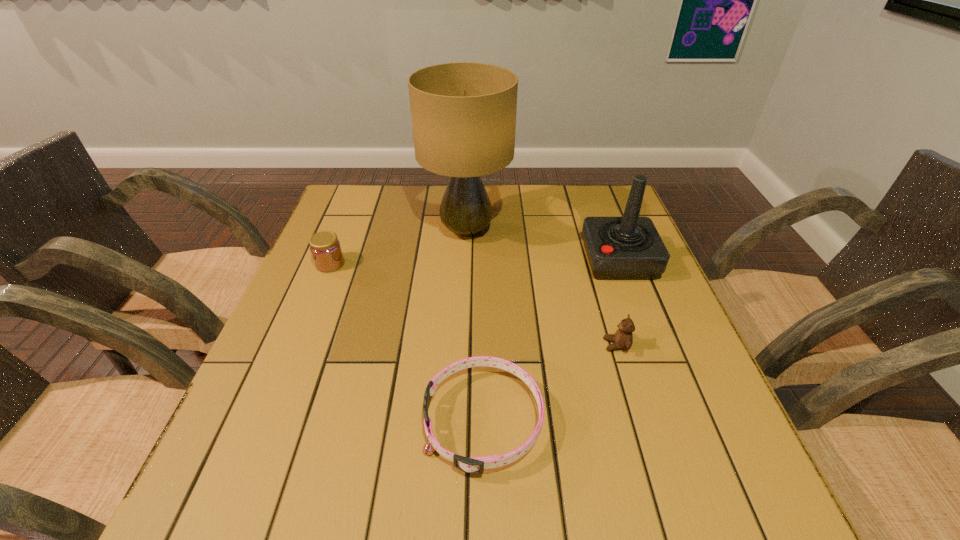
Locate an element on the screen. This screenshot has height=540, width=960. free spot that satisfies the following two spatial constraints: 1. on the back side of the tallest object; 2. on the left side of the jam is located at coordinates (344, 231).